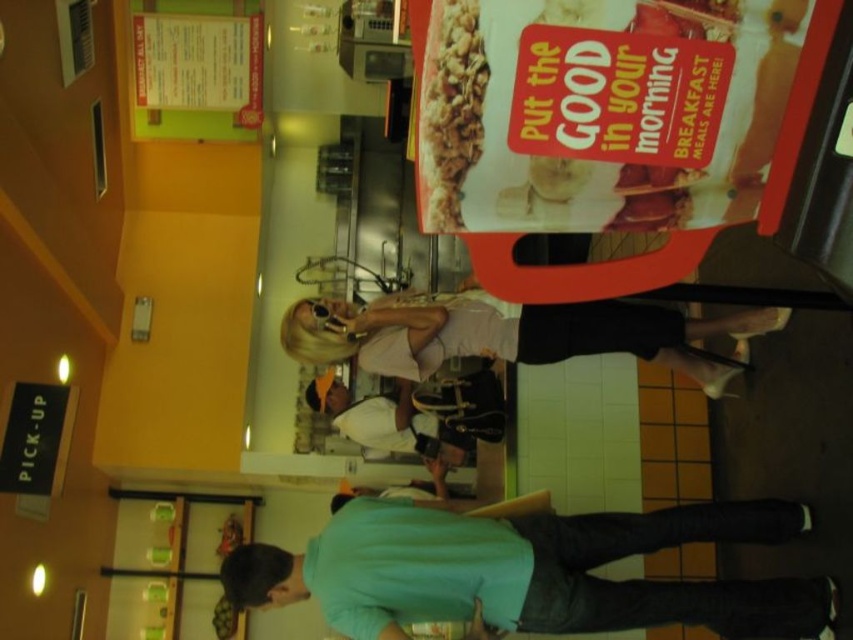
You are a customer in this McDonalds and you want to look at the white fabric shirt at center and the matte cardboard poster at upper center. Which one is located to the right of the other?

The matte cardboard poster at upper center is positioned on the right side of white fabric shirt at center.

You are a customer at the McDonalds in the image. You see a light beige fabric dress at center and a crumbly granola bar at center. Which item takes up more space horizontally?

The light beige fabric dress at center has a larger width than the crumbly granola bar at center, so it takes up more horizontal space.